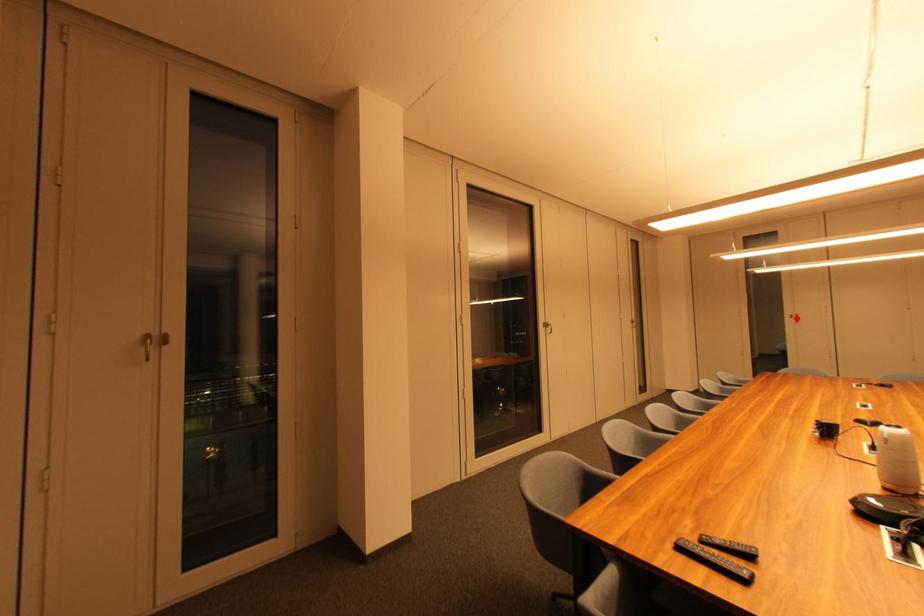
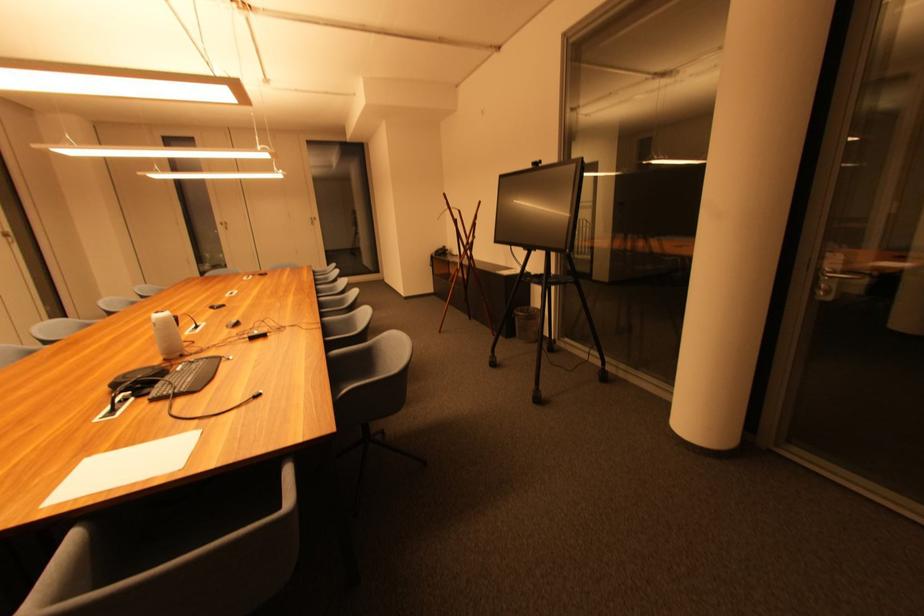
Find the pixel in the second image that matches the highlighted location in the first image.

(226, 225)